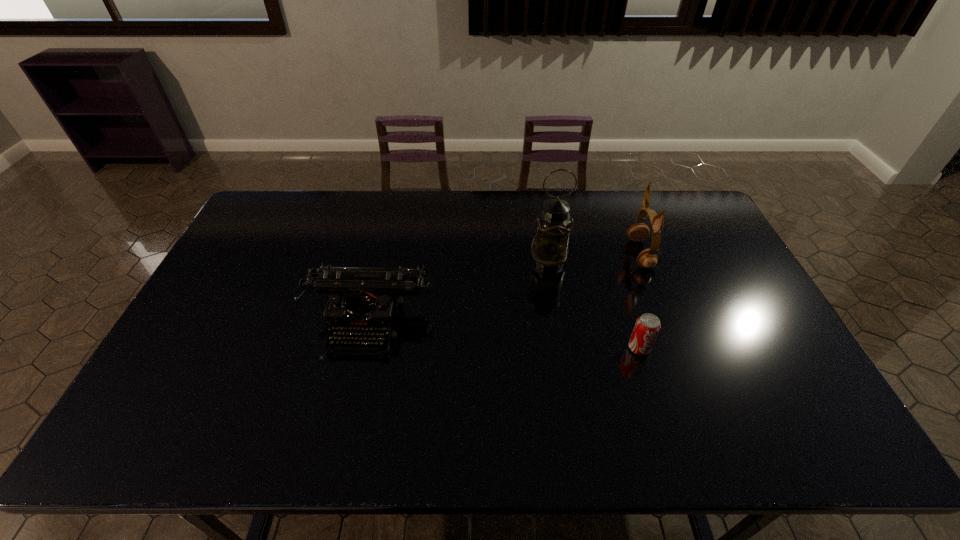
Find the location of a particular element. This screenshot has height=540, width=960. vacant space located on the front-facing side of the earphone is located at coordinates (614, 254).

Where is `free location located on the front-facing side of the earphone`? This screenshot has width=960, height=540. free location located on the front-facing side of the earphone is located at coordinates (547, 254).

The width and height of the screenshot is (960, 540). What are the coordinates of `free point located 0.140m on the keyboard of the second shortest object` in the screenshot? It's located at (350, 407).

At what (x,y) coordinates should I click in order to perform the action: click on vacant space located on the logo side of the shortest object. Please return your answer as a coordinate pair (x, y). Looking at the image, I should click on (660, 413).

What are the coordinates of `free location at the far edge` in the screenshot? It's located at (423, 222).

Image resolution: width=960 pixels, height=540 pixels. In the image, there is a desktop. Identify the location of vacant space at the near edge. (395, 437).

Where is `vacant point at the left edge`? The height and width of the screenshot is (540, 960). vacant point at the left edge is located at coordinates (231, 322).

Identify the location of vacant space at the right edge of the desktop. Image resolution: width=960 pixels, height=540 pixels. (779, 336).

Find the location of a particular element. vacant space at the far left corner of the desktop is located at coordinates (283, 215).

In the image, there is a desktop. Where is `blank space at the far right corner`? This screenshot has width=960, height=540. blank space at the far right corner is located at coordinates (673, 214).